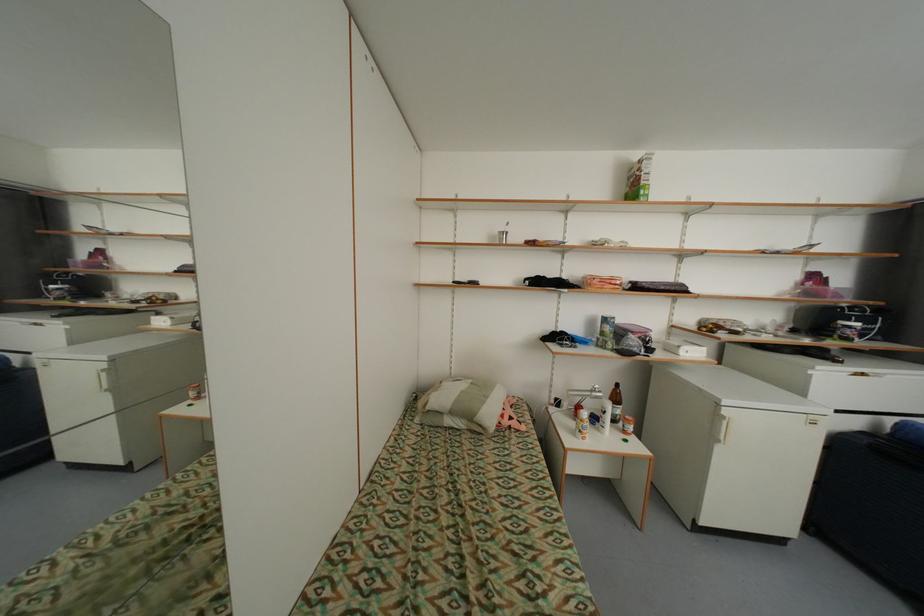
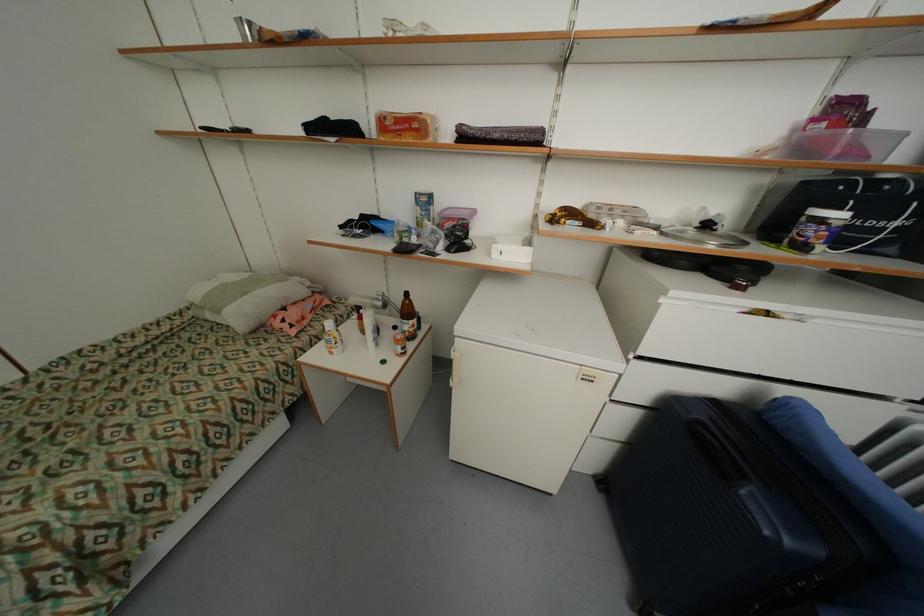
The point at (800, 331) is marked in the first image. Where is the corresponding point in the second image?

(713, 227)